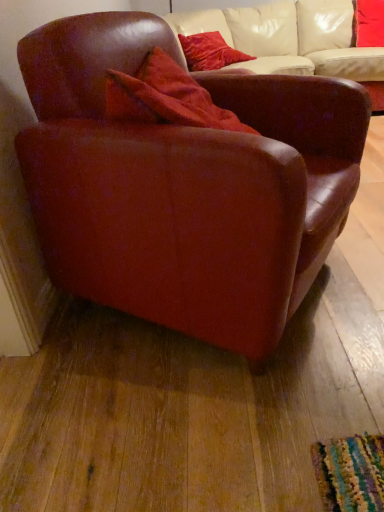
Question: Based on their sizes in the image, would you say velvet red pillow at upper center, the second pillow positioned from the left, is bigger or smaller than leather armchair at left?

Choices:
 (A) small
 (B) big

Answer: (A)

Question: Does point (380, 45) appear closer or farther from the camera than point (119, 298)?

Choices:
 (A) farther
 (B) closer

Answer: (A)

Question: Which of these objects is positioned farthest from the velvet red pillow at upper center, acting as the 1th pillow starting from the right?

Choices:
 (A) velvet red pillow at upper center, which is the 2th pillow from right to left
 (B) leather armchair at left

Answer: (B)

Question: Estimate the real-world distances between objects in this image. Which object is farther from the velvet red pillow at upper center, the first pillow in the left-to-right sequence?

Choices:
 (A) velvet red pillow at upper center, acting as the 1th pillow starting from the right
 (B) leather armchair at left

Answer: (B)